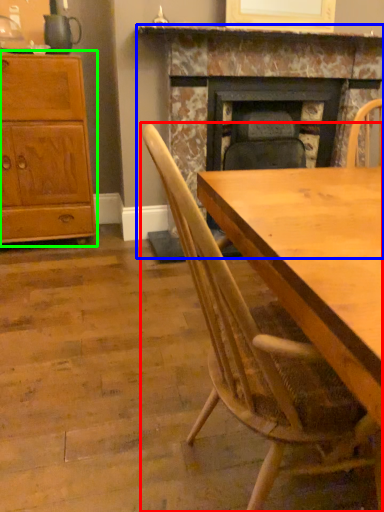
Question: Which object is the farthest from chair (highlighted by a red box)? Choose among these: fireplace (highlighted by a blue box) or cabinetry (highlighted by a green box).

Choices:
 (A) fireplace
 (B) cabinetry

Answer: (B)